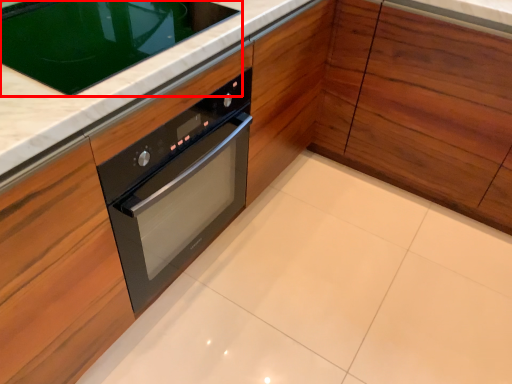
Question: Considering the relative positions of home appliance (annotated by the red box) and cabinetry in the image provided, where is home appliance (annotated by the red box) located with respect to the staircase?

Choices:
 (A) right
 (B) left

Answer: (B)